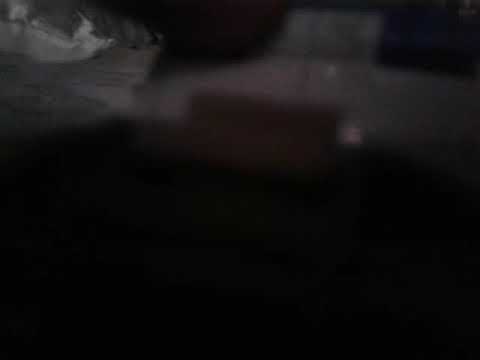
This screenshot has width=480, height=360. In order to click on shadow of possibly a table in this screenshot , I will do `click(164, 309)`.